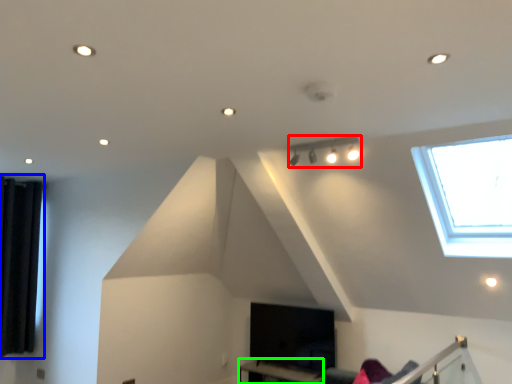
Question: Which is nearer to the lamp (highlighted by a red box)? curtain (highlighted by a blue box) or table (highlighted by a green box).

Choices:
 (A) curtain
 (B) table

Answer: (B)